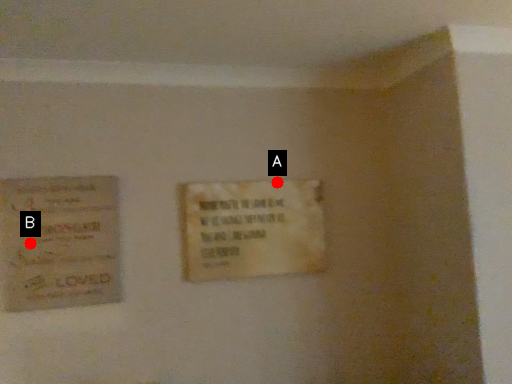
Question: Two points are circled on the image, labeled by A and B beside each circle. Which of the following is the closest to the observer?

Choices:
 (A) A is closer
 (B) B is closer

Answer: (B)